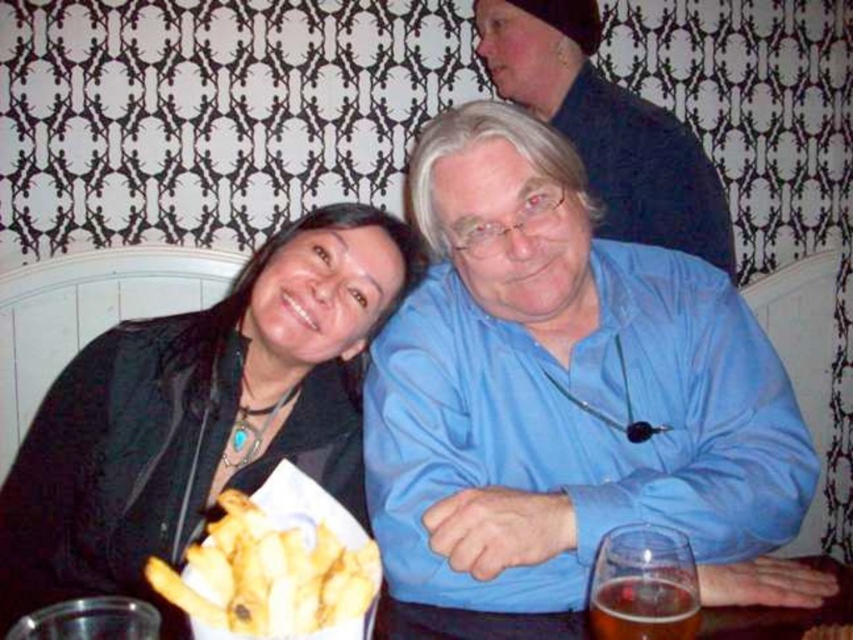
You are a photographer setting up for a group photo. You notice two jackets in the scene, the black leather jacket at upper left and the matte black jacket at upper center. Which jacket should you adjust to ensure they don t overlap in the frame?

The black leather jacket at upper left might be wider than the matte black jacket at upper center, so you should adjust the black leather jacket at upper left to prevent overlapping.

You are a photographer setting up for a group photo. You notice two jackets in the scene, the black leather jacket at upper left and the matte black jacket at upper center. Which jacket should you adjust to ensure both jackets are at the same height in the frame?

The black leather jacket at upper left is not as tall as the matte black jacket at upper center, so you should adjust the black leather jacket at upper left to raise its position to match the height of the matte black jacket at upper center.

You are a photographer standing in front of the scene. You want to take a closeup photo of the black leather jacket at upper left. Considering your current position, is the jacket within a comfortable arm reach for you to adjust its position before taking the photo?

The black leather jacket at upper left is 36.74 inches from viewer, so yes, it is within a comfortable arm reach for adjustment before taking the photo.